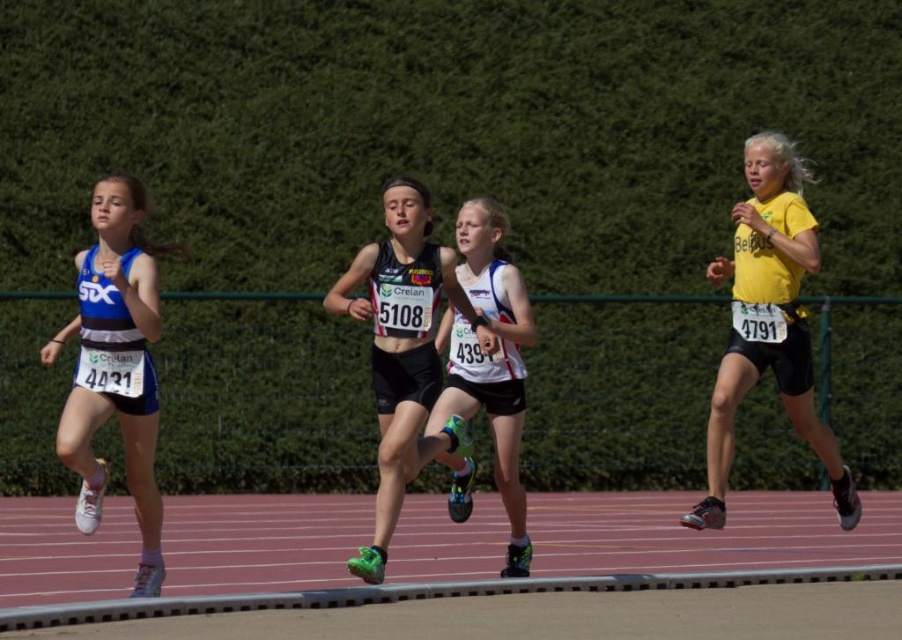
Is matte blue tank top at left wider than white matte tank top at center?

Correct, the width of matte blue tank top at left exceeds that of white matte tank top at center.

Which is behind, point (135, 460) or point (485, 209)?

The point (485, 209) is behind.

The width and height of the screenshot is (902, 640). What do you see at coordinates (115, 365) in the screenshot? I see `matte blue tank top at left` at bounding box center [115, 365].

Find the location of a particular element. matte blue tank top at left is located at coordinates (x=115, y=365).

Is point (393, 381) behind point (457, 323)?

No.

Who is shorter, black matte running shoe at center or white matte tank top at center?

black matte running shoe at center is shorter.

Is point (397, 307) positioned behind point (485, 397)?

No, (397, 307) is closer to viewer.

Find the location of `black matte running shoe at center`. black matte running shoe at center is located at coordinates (400, 342).

Which is in front, point (728, 458) or point (150, 484)?

Point (150, 484)

Does point (741, 314) lie behind point (123, 429)?

Yes, point (741, 314) is farther from viewer.

Locate an element on the screen. The image size is (902, 640). yellow matte shirt at right is located at coordinates (769, 323).